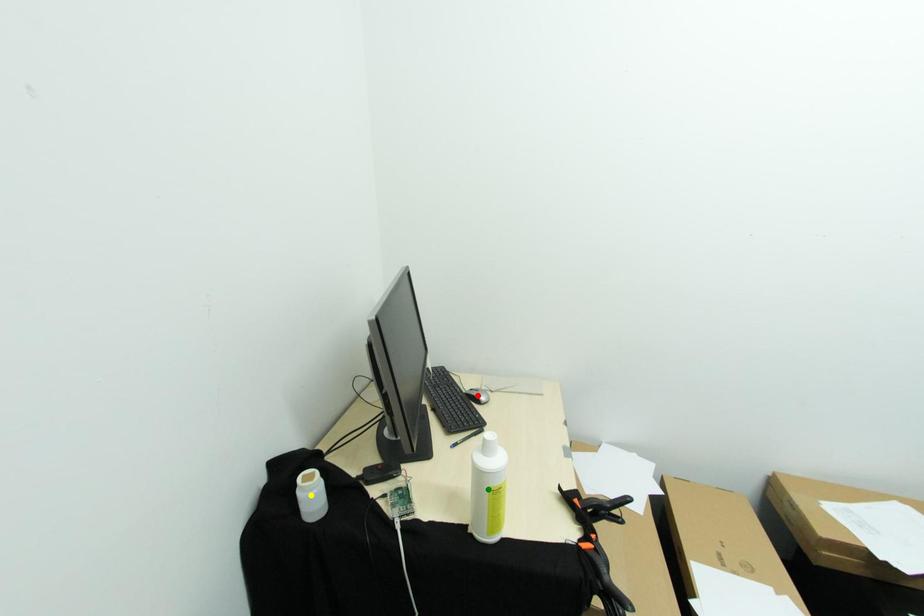
Order these from nearest to farthest:
red point, yellow point, green point

1. green point
2. yellow point
3. red point